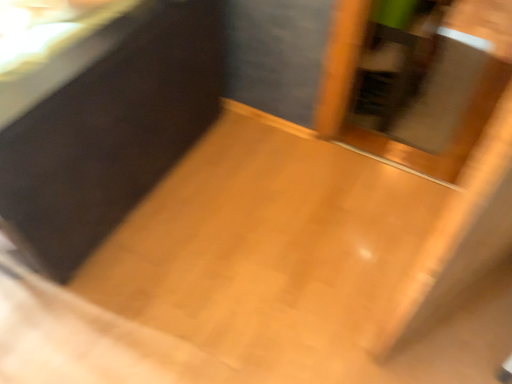
Question: Would you consider matte black vanity at upper left to be distant from transparent glass screen door at center?

Choices:
 (A) yes
 (B) no

Answer: (B)

Question: From the image's perspective, would you say matte black vanity at upper left is positioned over transparent glass screen door at center?

Choices:
 (A) no
 (B) yes

Answer: (A)

Question: Considering the relative sizes of matte black vanity at upper left and transparent glass screen door at center in the image provided, is matte black vanity at upper left wider than transparent glass screen door at center?

Choices:
 (A) no
 (B) yes

Answer: (A)

Question: From a real-world perspective, is matte black vanity at upper left beneath transparent glass screen door at center?

Choices:
 (A) no
 (B) yes

Answer: (A)

Question: Is matte black vanity at upper left in contact with transparent glass screen door at center?

Choices:
 (A) yes
 (B) no

Answer: (B)

Question: From a real-world perspective, is matte black vanity at upper left located higher than transparent glass screen door at center?

Choices:
 (A) yes
 (B) no

Answer: (A)

Question: Is transparent glass screen door at center outside of matte black vanity at upper left?

Choices:
 (A) no
 (B) yes

Answer: (B)

Question: Is transparent glass screen door at center looking in the opposite direction of matte black vanity at upper left?

Choices:
 (A) yes
 (B) no

Answer: (B)

Question: Does transparent glass screen door at center have a lesser width compared to matte black vanity at upper left?

Choices:
 (A) no
 (B) yes

Answer: (A)

Question: Does transparent glass screen door at center have a smaller size compared to matte black vanity at upper left?

Choices:
 (A) yes
 (B) no

Answer: (A)

Question: Is transparent glass screen door at center at the left side of matte black vanity at upper left?

Choices:
 (A) no
 (B) yes

Answer: (A)

Question: From the image's perspective, is transparent glass screen door at center under matte black vanity at upper left?

Choices:
 (A) no
 (B) yes

Answer: (A)

Question: From a real-world perspective, is transparent glass screen door at center physically located above or below matte black vanity at upper left?

Choices:
 (A) below
 (B) above

Answer: (A)